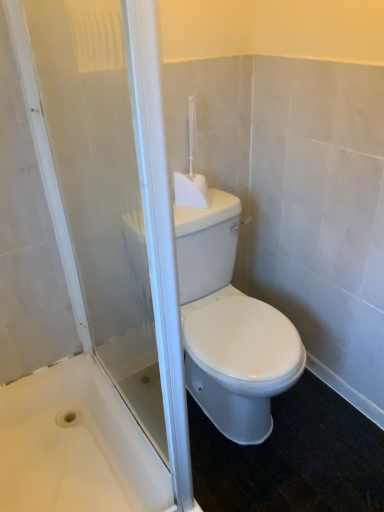
Measure the distance between point (141, 492) and camera.

Point (141, 492) and camera are 1.27 meters apart from each other.

This screenshot has height=512, width=384. What are the coordinates of `white plastic toilet brush at upper center` in the screenshot? It's located at (191, 175).

Considering the positions of point (128, 319) and point (206, 189), is point (128, 319) closer or farther from the camera than point (206, 189)?

Clearly, point (128, 319) is more distant from the camera than point (206, 189).

Relative to white plastic toilet brush at upper center, is transparent glass screen door at center in front or behind?

Clearly, transparent glass screen door at center is in front of white plastic toilet brush at upper center.

Is transparent glass screen door at center smaller than white plastic toilet brush at upper center?

No.

Locate an element on the screen. screen door on the left side of white plastic toilet brush at upper center is located at coordinates (100, 279).

Is transparent glass screen door at center inside or outside of white glossy toilet at center?

transparent glass screen door at center is not inside white glossy toilet at center, it's outside.

Which object is positioned more to the right, transparent glass screen door at center or white glossy toilet at center?

white glossy toilet at center is more to the right.

Is transparent glass screen door at center closer to the viewer compared to white glossy toilet at center?

Yes, it is.

Is white glossy toilet at center located outside transparent glass screen door at center?

Yes.

Between point (265, 323) and point (161, 327), which one is positioned behind?

The point (265, 323) is farther from the camera.

Is white glossy toilet at center turned away from transparent glass screen door at center?

No, white glossy toilet at center's orientation is not away from transparent glass screen door at center.

Based on the photo, is there a large distance between white glossy toilet at center and transparent glass screen door at center?

white glossy toilet at center is actually quite close to transparent glass screen door at center.

Who is taller, white glossy bathtub at lower left or white plastic toilet brush at upper center?

Standing taller between the two is white plastic toilet brush at upper center.

Who is bigger, white glossy bathtub at lower left or white plastic toilet brush at upper center?

Bigger between the two is white glossy bathtub at lower left.

Looking at this image, from a real-world perspective, who is located higher, white glossy bathtub at lower left or white plastic toilet brush at upper center?

white plastic toilet brush at upper center.

Measure the distance from white glossy bathtub at lower left to white plastic toilet brush at upper center.

They are 34.33 inches apart.

Can you tell me how much transparent glass screen door at center and white glossy bathtub at lower left differ in facing direction?

transparent glass screen door at center and white glossy bathtub at lower left are facing 0.665 degrees away from each other.

Is transparent glass screen door at center completely or partially outside of white glossy bathtub at lower left?

Yes, transparent glass screen door at center is outside of white glossy bathtub at lower left.

Does transparent glass screen door at center touch white glossy bathtub at lower left?

No, transparent glass screen door at center is not in contact with white glossy bathtub at lower left.

Consider the image. Considering the relative sizes of transparent glass screen door at center and white glossy bathtub at lower left in the image provided, is transparent glass screen door at center smaller than white glossy bathtub at lower left?

Yes, transparent glass screen door at center is smaller than white glossy bathtub at lower left.

Is white plastic toilet brush at upper center directly adjacent to white glossy bathtub at lower left?

white plastic toilet brush at upper center and white glossy bathtub at lower left are clearly separated.

Which is nearer, (181, 180) or (124, 430)?

The point (124, 430) is in front.

Does white plastic toilet brush at upper center lie in front of white glossy bathtub at lower left?

No, the depth of white plastic toilet brush at upper center is greater than that of white glossy bathtub at lower left.

Which of these two, white plastic toilet brush at upper center or white glossy bathtub at lower left, is wider?

white glossy bathtub at lower left.

Considering the sizes of objects white plastic toilet brush at upper center and transparent glass screen door at center in the image provided, who is smaller, white plastic toilet brush at upper center or transparent glass screen door at center?

Smaller between the two is white plastic toilet brush at upper center.

Is the depth of white plastic toilet brush at upper center less than that of transparent glass screen door at center?

No, it is behind transparent glass screen door at center.

Looking at their sizes, would you say white plastic toilet brush at upper center is wider or thinner than transparent glass screen door at center?

white plastic toilet brush at upper center is wider than transparent glass screen door at center.

Find the location of a particular element. screen door located in front of the white plastic toilet brush at upper center is located at coordinates (100, 279).

Locate an element on the screen. The width and height of the screenshot is (384, 512). screen door located above the white glossy toilet at center (from a real-world perspective) is located at coordinates (100, 279).

In the scene shown: Based on their spatial positions, is white glossy bathtub at lower left or white glossy toilet at center closer to transparent glass screen door at center?

Based on the image, white glossy bathtub at lower left appears to be nearer to transparent glass screen door at center.

Which object lies further to the anchor point white glossy toilet at center, white glossy bathtub at lower left or transparent glass screen door at center?

white glossy bathtub at lower left lies further to white glossy toilet at center than the other object.

Looking at the image, which one is located further to transparent glass screen door at center, white glossy bathtub at lower left or white plastic toilet brush at upper center?

white plastic toilet brush at upper center lies further to transparent glass screen door at center than the other object.

Estimate the real-world distances between objects in this image. Which object is closer to transparent glass screen door at center, white plastic toilet brush at upper center or white glossy toilet at center?

Among the two, white glossy toilet at center is located nearer to transparent glass screen door at center.

Which object lies further to the anchor point white glossy toilet at center, white glossy bathtub at lower left or white plastic toilet brush at upper center?

Based on the image, white glossy bathtub at lower left appears to be further to white glossy toilet at center.

When comparing their distances from white plastic toilet brush at upper center, does white glossy bathtub at lower left or white glossy toilet at center seem closer?

Among the two, white glossy toilet at center is located nearer to white plastic toilet brush at upper center.

From the image, which object appears to be farther from white glossy bathtub at lower left, white plastic toilet brush at upper center or transparent glass screen door at center?

Based on the image, white plastic toilet brush at upper center appears to be further to white glossy bathtub at lower left.

When comparing their distances from transparent glass screen door at center, does white glossy toilet at center or white glossy bathtub at lower left seem closer?

Among the two, white glossy bathtub at lower left is located nearer to transparent glass screen door at center.

The width and height of the screenshot is (384, 512). In order to click on porcelain between white plastic toilet brush at upper center and white glossy bathtub at lower left vertically in this screenshot , I will do [x=229, y=327].

I want to click on screen door between white plastic toilet brush at upper center and white glossy bathtub at lower left in the vertical direction, so click(x=100, y=279).

Locate an element on the screen. The image size is (384, 512). bath between transparent glass screen door at center and white glossy toilet at center in the front-back direction is located at coordinates 75,446.

The height and width of the screenshot is (512, 384). In order to click on porcelain between transparent glass screen door at center and white plastic toilet brush at upper center along the z-axis in this screenshot , I will do `click(229, 327)`.